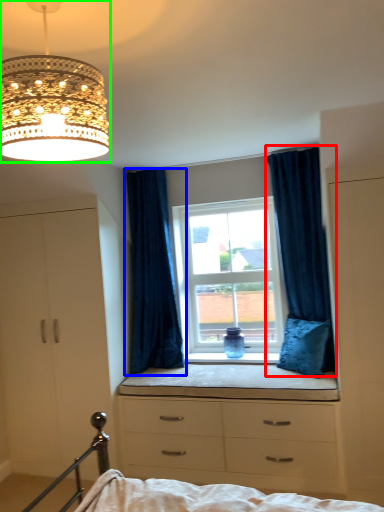
Question: Which is nearer to the curtain (highlighted by a red box)? curtain (highlighted by a blue box) or lamp (highlighted by a green box).

Choices:
 (A) curtain
 (B) lamp

Answer: (A)